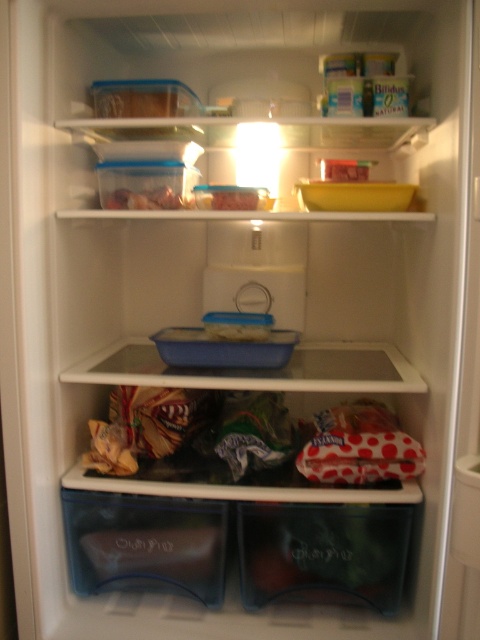
Question: Among these objects, which one is farthest from the camera?

Choices:
 (A) translucent plastic container at upper center
 (B) polka dot fabric bag at center

Answer: (A)

Question: Does polka dot fabric bag at center appear over translucent plastic container at upper center?

Choices:
 (A) yes
 (B) no

Answer: (B)

Question: Is polka dot fabric bag at center smaller than translucent plastic container at upper center?

Choices:
 (A) yes
 (B) no

Answer: (B)

Question: Which object is closer to the camera taking this photo?

Choices:
 (A) translucent plastic container at upper center
 (B) polka dot fabric bag at center

Answer: (B)

Question: Does polka dot fabric bag at center come in front of translucent plastic container at upper center?

Choices:
 (A) no
 (B) yes

Answer: (B)

Question: Which of the following is the farthest from the observer?

Choices:
 (A) (287, 440)
 (B) (187, 208)

Answer: (A)